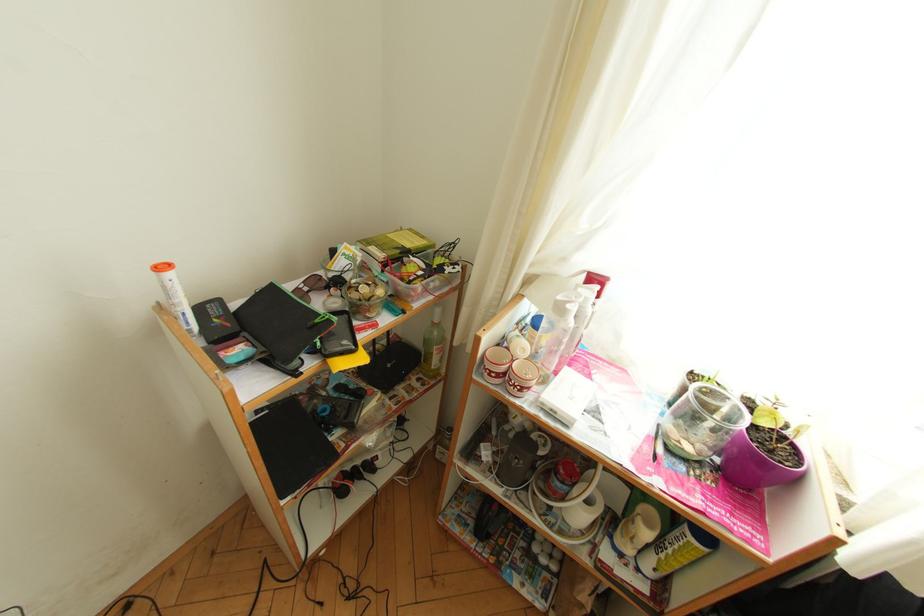
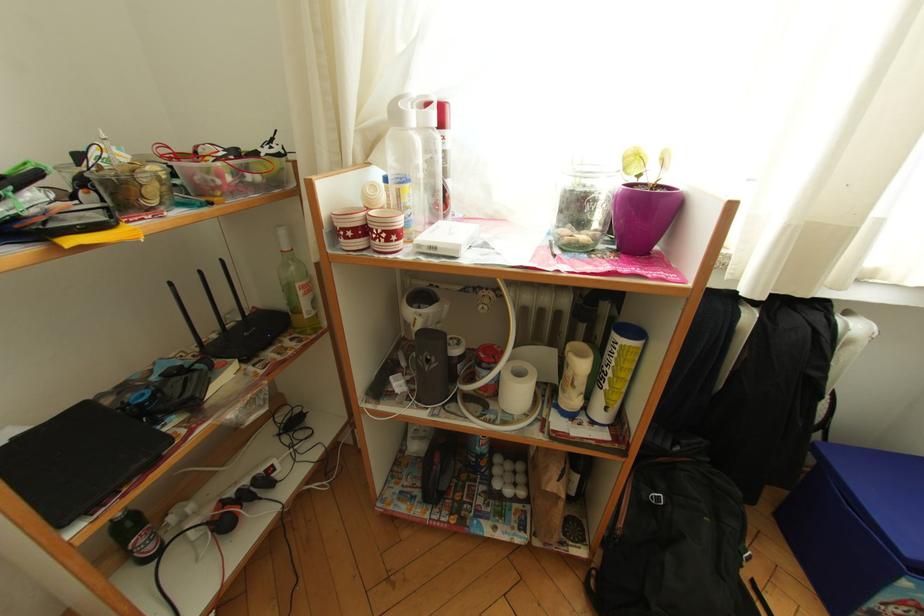
Question: The camera is either moving clockwise (left) or counter-clockwise (right) around the object. The first image is from the beginning of the video and the second image is from the end. Is the camera moving left or right when shooting the video?

Choices:
 (A) Left
 (B) Right

Answer: (A)